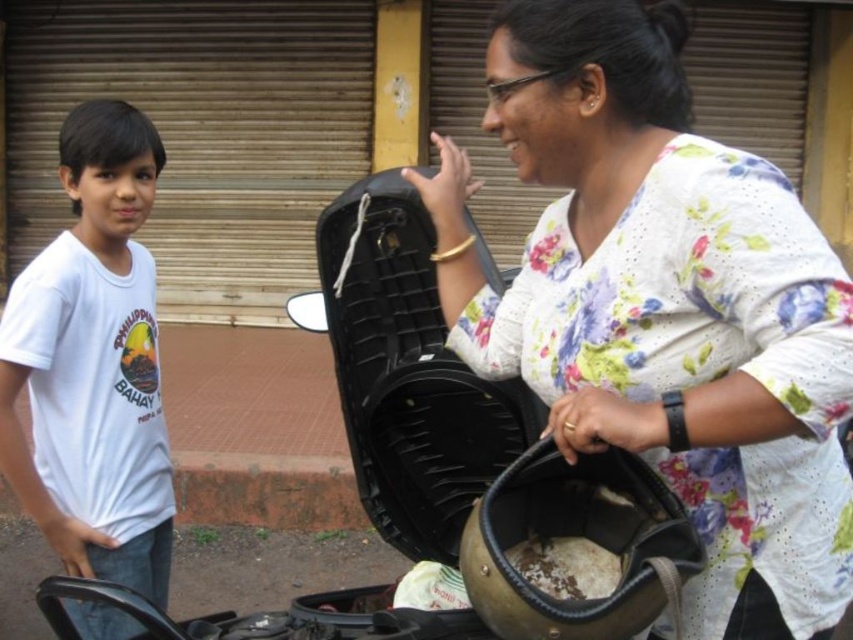
Question: Does floral cotton shirt at center have a greater width compared to white cotton t-shirt at left?

Choices:
 (A) yes
 (B) no

Answer: (A)

Question: Is floral cotton shirt at center bigger than white cotton t-shirt at left?

Choices:
 (A) no
 (B) yes

Answer: (B)

Question: Which object is closer to the camera taking this photo?

Choices:
 (A) floral cotton shirt at center
 (B) white cotton t-shirt at left

Answer: (A)

Question: Is floral cotton shirt at center positioned in front of white cotton t-shirt at left?

Choices:
 (A) no
 (B) yes

Answer: (B)